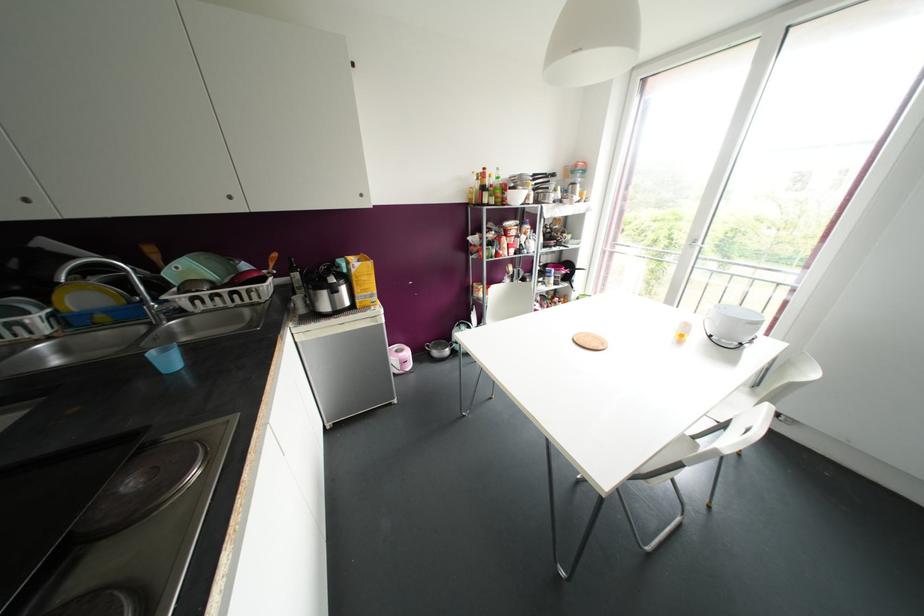
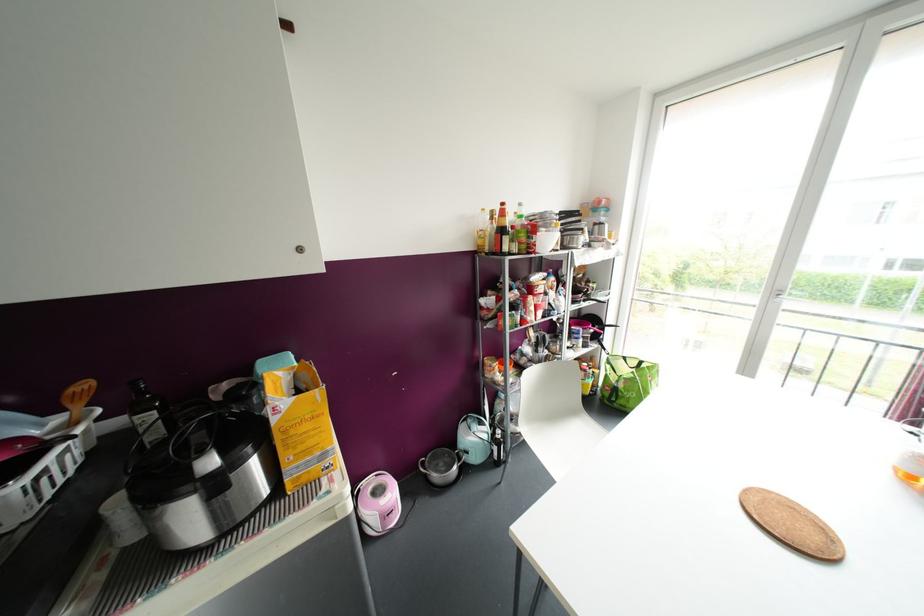
Find the pixel in the second image that matches (296,275) in the first image.

(150, 416)